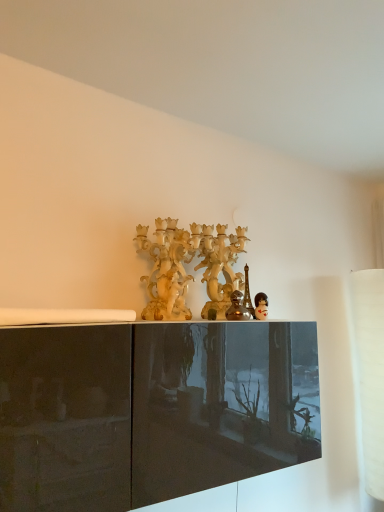
Question: Would you say metallic silver figurine at center is inside or outside matte cream candelabra at center?

Choices:
 (A) inside
 (B) outside

Answer: (B)

Question: Is metallic silver figurine at center to the left or to the right of matte cream candelabra at center in the image?

Choices:
 (A) right
 (B) left

Answer: (A)

Question: Which object is the closest to the matte cream candelabra at center?

Choices:
 (A) matte black doll at center
 (B) metallic silver figurine at center

Answer: (B)

Question: Which object is the closest to the matte cream candelabra at center?

Choices:
 (A) matte black doll at center
 (B) metallic silver figurine at center

Answer: (B)